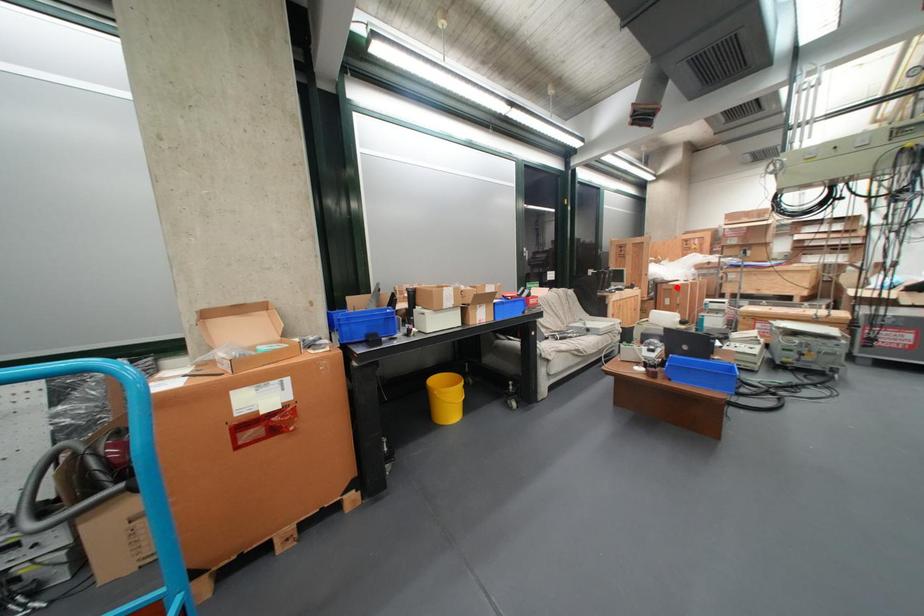
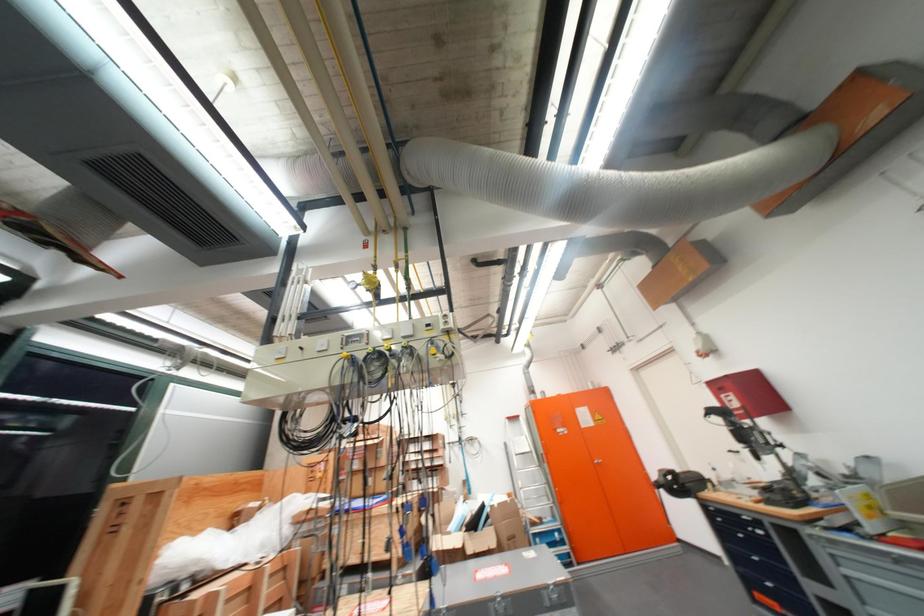
Find the pixel in the second image that matches the highlighted location in the first image.

(187, 610)